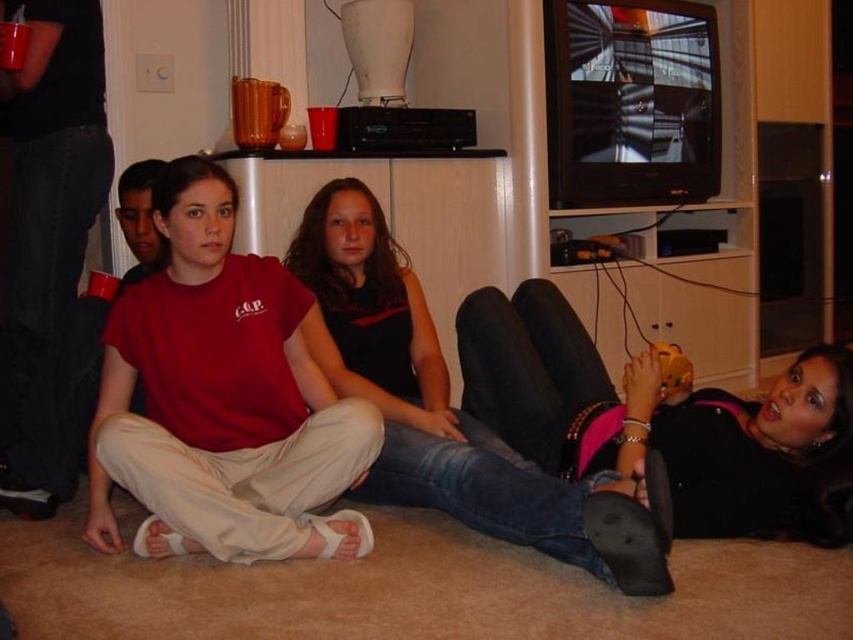
Question: Can you confirm if matte red t-shirt at center is smaller than jeans at center?

Choices:
 (A) no
 (B) yes

Answer: (B)

Question: Which of the following is the farthest from the observer?

Choices:
 (A) jeans at center
 (B) matte red t-shirt at center

Answer: (B)

Question: Can you confirm if matte red t-shirt at center is positioned to the right of jeans at center?

Choices:
 (A) no
 (B) yes

Answer: (A)

Question: Is matte red t-shirt at center above jeans at center?

Choices:
 (A) yes
 (B) no

Answer: (A)

Question: Which point appears farthest from the camera in this image?

Choices:
 (A) (90, 541)
 (B) (434, 403)

Answer: (B)

Question: Which object appears closest to the camera in this image?

Choices:
 (A) matte red t-shirt at center
 (B) jeans at center

Answer: (B)